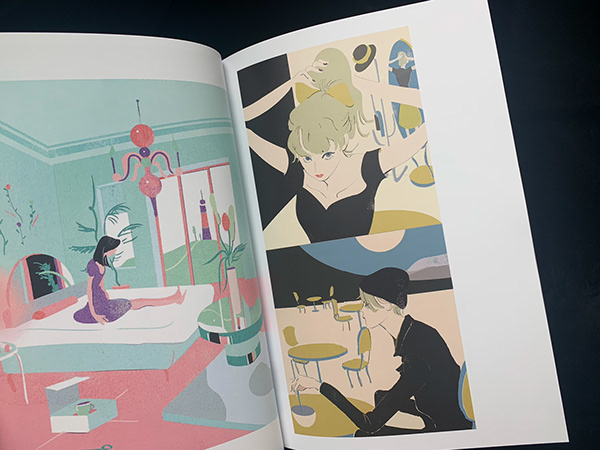
This screenshot has height=450, width=600. Identify the location of tables. (349, 307), (326, 353), (315, 297), (330, 419), (216, 320).